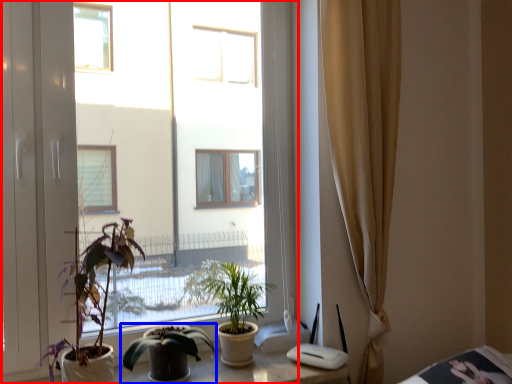
Question: Among these objects, which one is nearest to the camera, window (highlighted by a red box) or houseplant (highlighted by a blue box)?

Choices:
 (A) window
 (B) houseplant

Answer: (A)